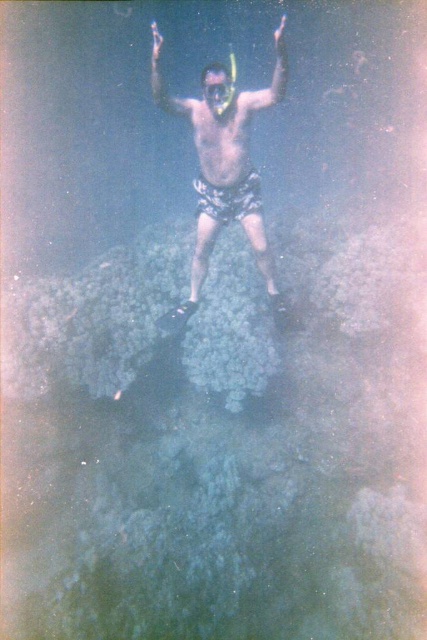
You are a diver preparing to swim to the point marked at coordinates [227,83]. Given that your oxygen tank allows you to swim 10 meters before needing to resurface, will you be able to reach the point without resurfacing?

The point marked at coordinates [227,83] is 6.26 meters away from you, so yes, you can reach it without resurfacing since your oxygen tank allows swimming up to 10 meters.

You are a snorkeler trying to locate two points underwater. The first point is at coordinates point (240, 152) and the second is at point (160, 42). Which point is closer to you?

Point (240, 152) is further to the viewer than point (160, 42), so the second point at point (160, 42) is closer to you.

You are a marine biologist observing the underwater scene. You notice the smooth skin diver at center and the transparent plastic snorkel at upper center. Which object is closer to your viewpoint?

The smooth skin diver at center is closer to the viewpoint because it is positioned further to the viewer than the transparent plastic snorkel at upper center.